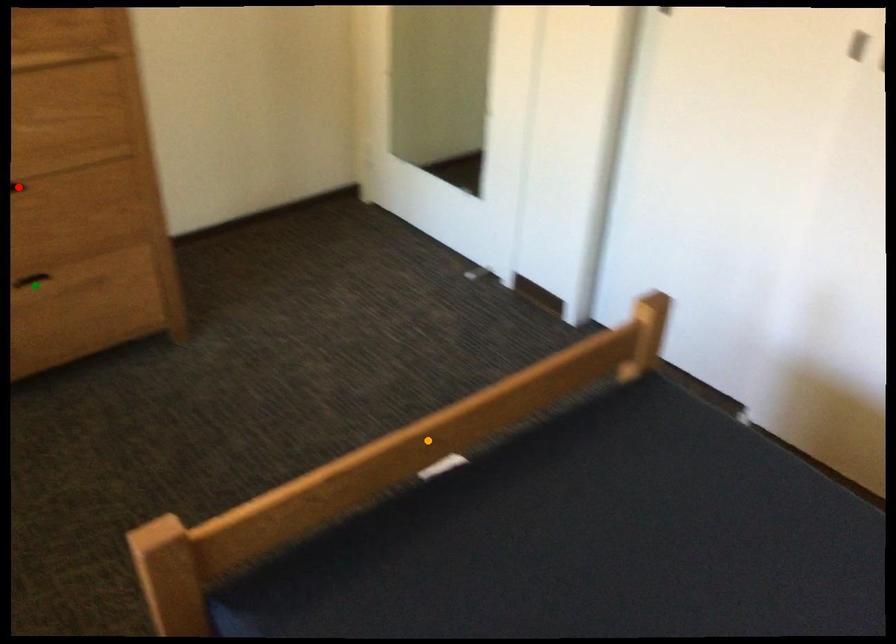
Order these from nearest to farthest:
green point | orange point | red point

1. orange point
2. red point
3. green point